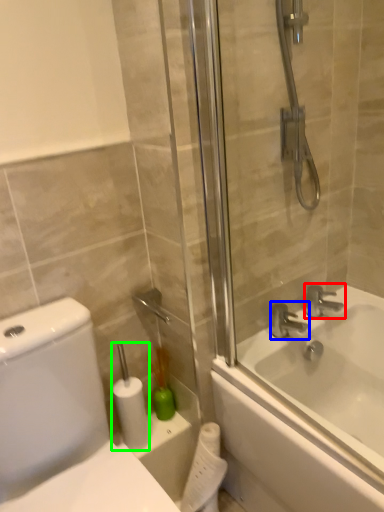
Question: Which object is positioned farthest from tap (highlighted by a red box)? Select from tap (highlighted by a blue box) and toilet paper (highlighted by a green box).

Choices:
 (A) tap
 (B) toilet paper

Answer: (B)